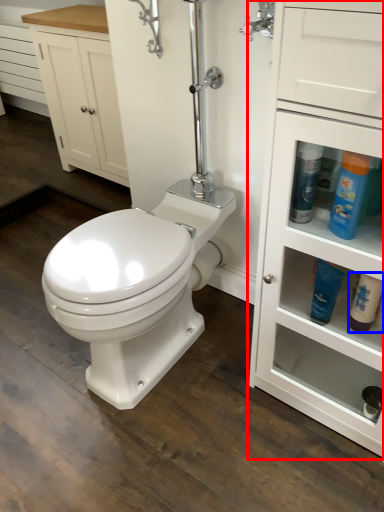
Question: Which object appears closest to the camera in this image, bathroom cabinet (highlighted by a red box) or cleaning product (highlighted by a blue box)?

Choices:
 (A) bathroom cabinet
 (B) cleaning product

Answer: (A)